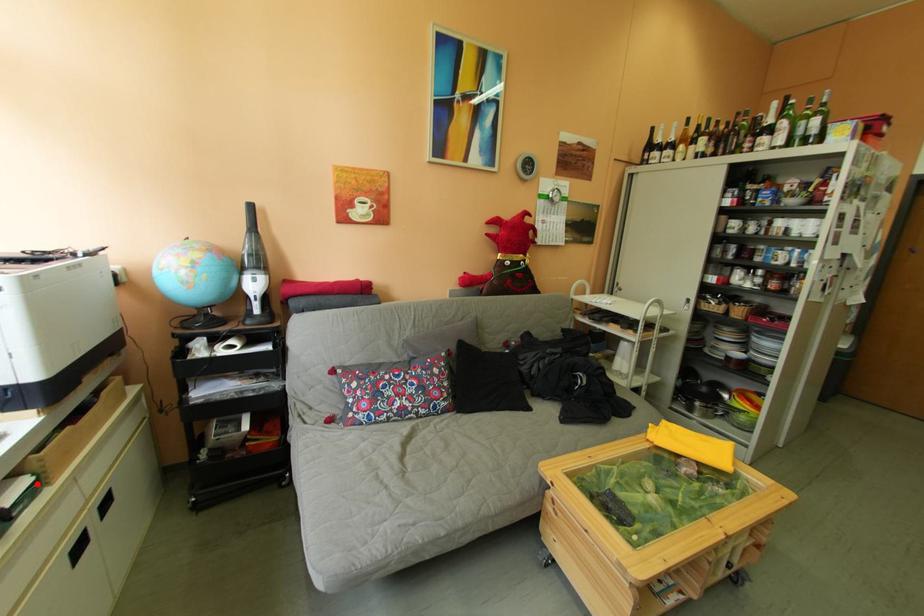
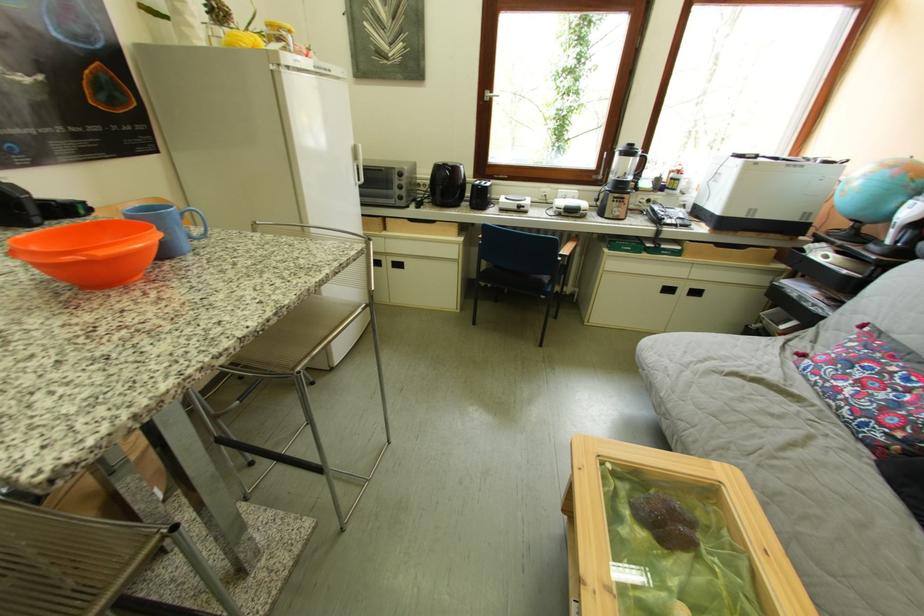
Locate, in the second image, the point that corresponds to the highlighted location in the first image.

(690, 251)